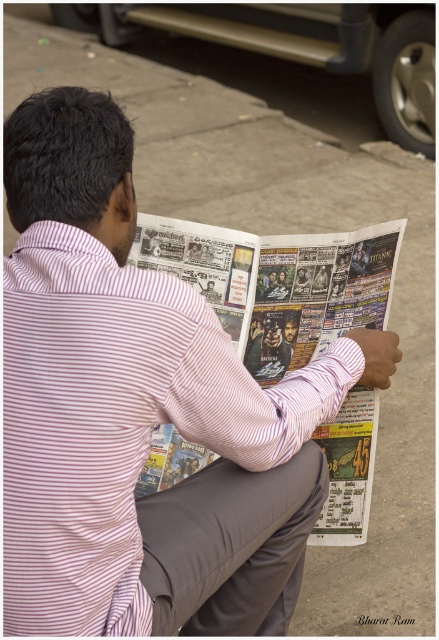
You are a photographer taking a picture of the man sitting on the curb. You want to focus on the printed newspaper at center and the gray cotton pants at lower center. Which object should you adjust your camera focus on first if you want to ensure both are in focus?

The printed newspaper at center should be focused on first because it is closer to the viewer than the gray cotton pants at lower center, so adjusting focus starting from the closer object ensures both are in focus.

You are a delivery person who needs to place a small package on the sidewalk next to the man. The package must be placed exactly between the printed newspaper at center and the gray cotton pants at lower center. Is there enough space between them to place the package?

The printed newspaper at center is 17.22 inches from gray cotton pants at lower center. Since the package needs to be placed exactly between them, there is sufficient space as the distance is more than enough to accommodate the package.

You are a delivery person who needs to place a small package between the printed newspaper at center and the gray cotton pants at lower center. Can you fit the package there?

The printed newspaper at center is wider than the gray cotton pants at lower center, so there is space between them to fit the small package.